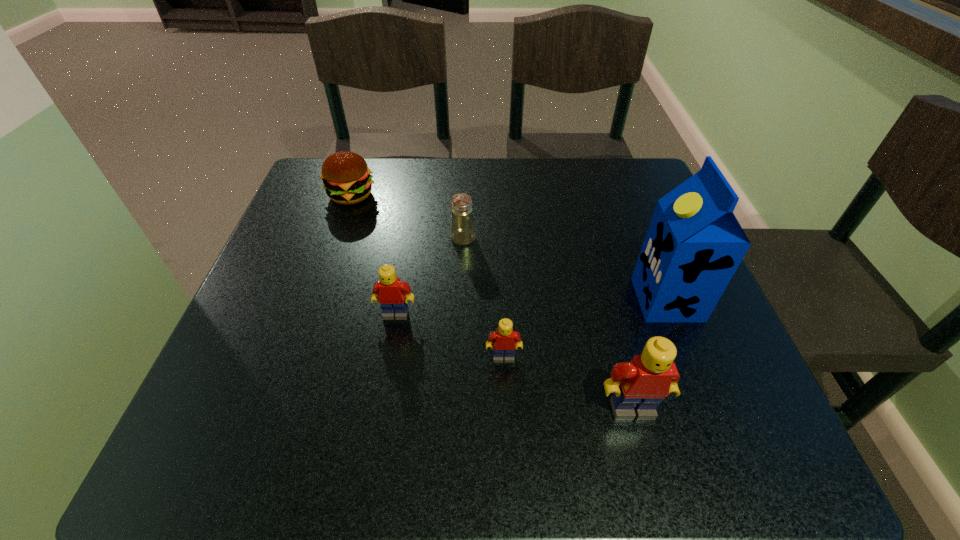
The image size is (960, 540). Identify the location of the tallest object. (694, 244).

You are a GUI agent. You are given a task and a screenshot of the screen. Output one action in this format:
    pyautogui.click(x=<x>, y=<y>)
    Task: Click on the carton
    This screenshot has width=960, height=540.
    Given the screenshot: What is the action you would take?
    pyautogui.click(x=694, y=244)

Locate an element on the screen. This screenshot has width=960, height=540. vacant region located 0.160m on the front-facing side of the farthest Lego is located at coordinates (381, 399).

Identify the location of vacant space located on the back of the hamburger. (363, 160).

Identify the location of free space located 0.340m on the front of the fifth nearest object. (457, 386).

What are the coordinates of `blank area located 0.390m with the cap open on the carton` in the screenshot? It's located at (436, 299).

Where is `free space located 0.090m with the cap open on the carton`? The height and width of the screenshot is (540, 960). free space located 0.090m with the cap open on the carton is located at coordinates (590, 299).

The height and width of the screenshot is (540, 960). I want to click on vacant space located with the cap open on the carton, so click(x=467, y=299).

At what (x,y) coordinates should I click in order to perform the action: click on object that is at the far edge. Please return your answer as a coordinate pair (x, y). Looking at the image, I should click on (346, 177).

Locate an element on the screen. This screenshot has height=540, width=960. object that is positioned at the left edge is located at coordinates (346, 177).